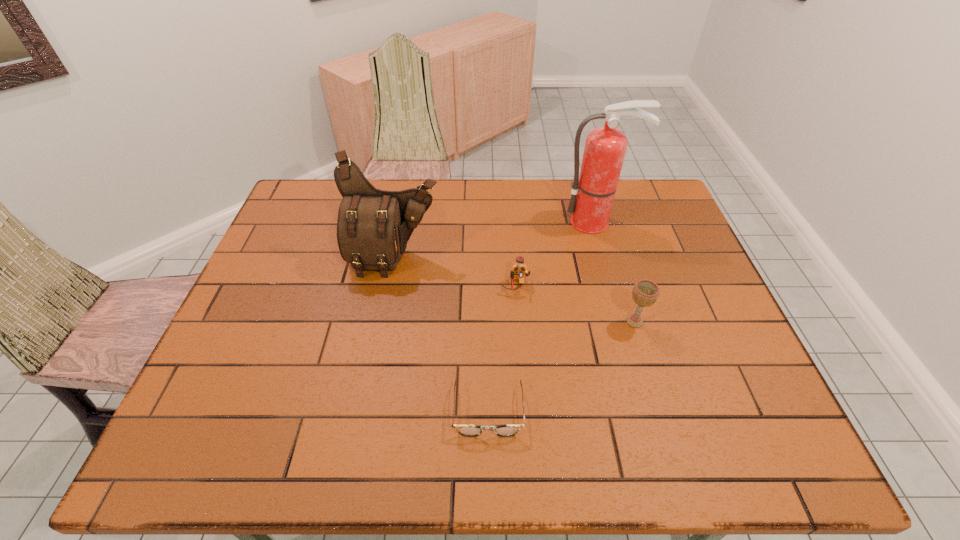
At what (x,y) coordinates should I click in order to perform the action: click on free space that is in between the chalice and the second shortest object. Please return your answer as a coordinate pair (x, y). Image resolution: width=960 pixels, height=540 pixels. Looking at the image, I should click on (575, 304).

Identify the location of free space that is in between the chalice and the Lego. click(x=575, y=304).

This screenshot has height=540, width=960. Identify the location of blank region between the Lego and the tallest object. (555, 254).

Locate which object ranks third in proximity to the fire extinguisher. Please provide its 2D coordinates. Your answer should be formatted as a tuple, i.e. [(x, y)], where the tuple contains the x and y coordinates of a point satisfying the conditions above.

[(373, 227)]

Locate an element on the screen. The width and height of the screenshot is (960, 540). the second closest object to the third tallest object is located at coordinates (465, 430).

This screenshot has height=540, width=960. In order to click on blank area in the image that satisfies the following two spatial constraints: 1. with the handle and hose on the fourth farthest object; 2. on the right side of the farthest object in this screenshot , I will do pyautogui.click(x=623, y=322).

Identify the location of vacant region that satisfies the following two spatial constraints: 1. on the front-facing side of the leftmost object; 2. on the left side of the fourth farthest object. (382, 322).